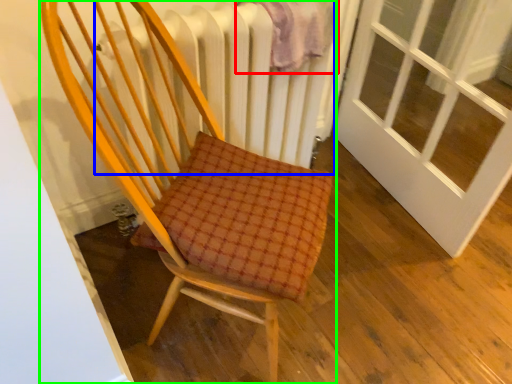
Question: Estimate the real-world distances between objects in this image. Which object is closer to blanket (highlighted by a red box), radiator (highlighted by a blue box) or chair (highlighted by a green box)?

Choices:
 (A) radiator
 (B) chair

Answer: (A)